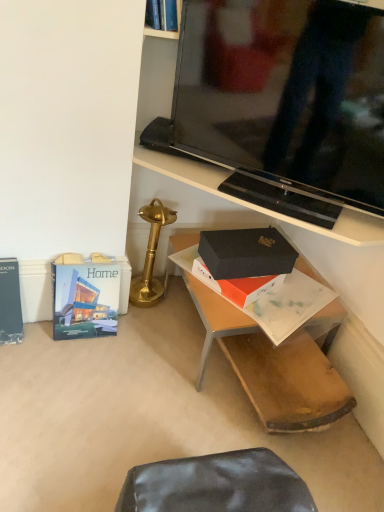
Find the location of `free space underneath black glossy tv stand at upper center (from a real-world perspective)`. free space underneath black glossy tv stand at upper center (from a real-world perspective) is located at coordinates (264, 199).